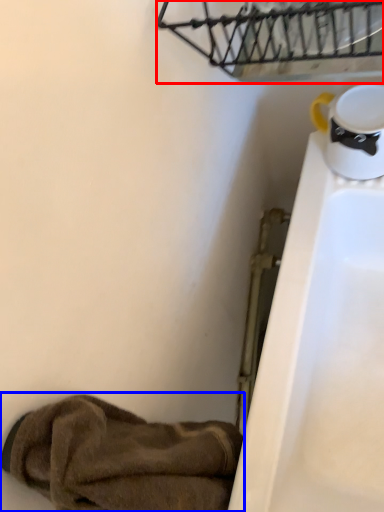
Question: Which object appears closest to the camera in this image, basket (highlighted by a red box) or footwear (highlighted by a blue box)?

Choices:
 (A) basket
 (B) footwear

Answer: (B)